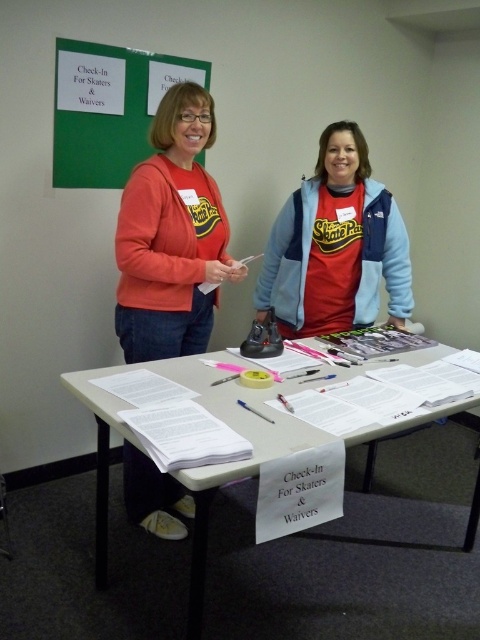
Does matte orange sweater at left lie behind matte red sweatshirt at center?

No, it is not.

Is matte orange sweater at left to the right of matte red sweatshirt at center from the viewer's perspective?

No, matte orange sweater at left is not to the right of matte red sweatshirt at center.

The width and height of the screenshot is (480, 640). Identify the location of matte orange sweater at left. (171, 236).

Does white paper at center have a larger size compared to matte red sweatshirt at left?

Correct, white paper at center is larger in size than matte red sweatshirt at left.

Which is below, white paper at center or matte red sweatshirt at left?

Positioned lower is white paper at center.

Where is `white paper at center`? The width and height of the screenshot is (480, 640). white paper at center is located at coordinates (228, 464).

I want to click on white paper at center, so click(x=228, y=464).

Who is more distant from viewer, [129,157] or [217,188]?

The point [129,157] is more distant.

Can you confirm if green matte board at upper left is taller than matte red sweatshirt at left?

Correct, green matte board at upper left is much taller as matte red sweatshirt at left.

What do you see at coordinates (108, 108) in the screenshot? The height and width of the screenshot is (640, 480). I see `green matte board at upper left` at bounding box center [108, 108].

The image size is (480, 640). I want to click on green matte board at upper left, so click(x=108, y=108).